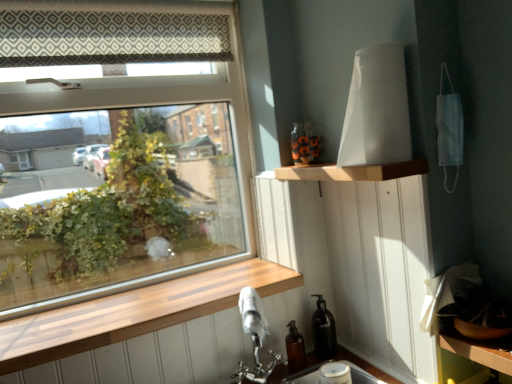
Question: Looking at the image, does wooden shelf at upper center seem bigger or smaller compared to wooden at lower left?

Choices:
 (A) small
 (B) big

Answer: (A)

Question: From the image's perspective, is wooden shelf at upper center above or below wooden at lower left?

Choices:
 (A) below
 (B) above

Answer: (B)

Question: Based on their relative distances, which object is nearer to the wooden at lower left?

Choices:
 (A) transparent glass window at upper left
 (B) wooden shelf at upper center

Answer: (B)

Question: Estimate the real-world distances between objects in this image. Which object is closer to the wooden shelf at upper center?

Choices:
 (A) wooden at lower left
 (B) transparent glass window at upper left

Answer: (A)